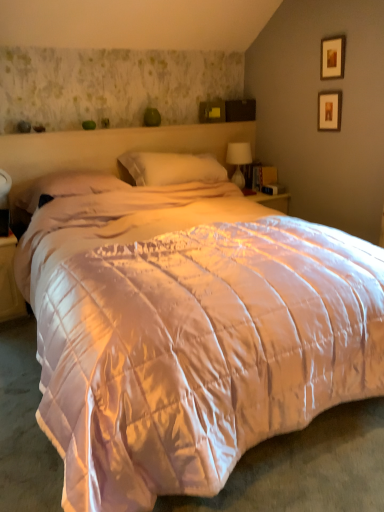
Question: Is pink satin pillow at center, the second pillow viewed from the right, to the left of wooden picture frame at upper right, placed as the second picture frame when sorted from bottom to top, from the viewer's perspective?

Choices:
 (A) yes
 (B) no

Answer: (A)

Question: From the image's perspective, would you say pink satin pillow at center, which is counted as the 1th pillow, starting from the left, is shown under wooden picture frame at upper right, placed as the second picture frame when sorted from bottom to top?

Choices:
 (A) yes
 (B) no

Answer: (A)

Question: Is pink satin pillow at center, the second pillow viewed from the right, turned away from wooden picture frame at upper right, placed as the second picture frame when sorted from bottom to top?

Choices:
 (A) yes
 (B) no

Answer: (B)

Question: Is wooden picture frame at upper right, which appears as the 1th picture frame when viewed from the top, completely or partially inside pink satin pillow at center, which is counted as the 1th pillow, starting from the left?

Choices:
 (A) no
 (B) yes

Answer: (A)

Question: From the image's perspective, is pink satin pillow at center, which is counted as the 1th pillow, starting from the left, on wooden picture frame at upper right, placed as the second picture frame when sorted from bottom to top?

Choices:
 (A) yes
 (B) no

Answer: (B)

Question: Is the position of pink satin pillow at center, which is counted as the 1th pillow, starting from the left, less distant than that of wooden picture frame at upper right, which appears as the 1th picture frame when viewed from the top?

Choices:
 (A) yes
 (B) no

Answer: (A)

Question: Does wooden picture frame at upper right, which appears as the 1th picture frame when viewed from the top, have a lesser width compared to pink satin pillow at center, the second pillow viewed from the right?

Choices:
 (A) no
 (B) yes

Answer: (B)

Question: Does wooden picture frame at upper right, which appears as the 1th picture frame when viewed from the top, have a smaller size compared to pink satin pillow at center, which is counted as the 1th pillow, starting from the left?

Choices:
 (A) no
 (B) yes

Answer: (B)

Question: Does wooden picture frame at upper right, which appears as the 1th picture frame when viewed from the top, turn towards pink satin pillow at center, which is counted as the 1th pillow, starting from the left?

Choices:
 (A) no
 (B) yes

Answer: (B)

Question: Is the surface of wooden picture frame at upper right, which appears as the 1th picture frame when viewed from the top, in direct contact with pink satin pillow at center, the second pillow viewed from the right?

Choices:
 (A) yes
 (B) no

Answer: (B)

Question: Is wooden picture frame at upper right, placed as the second picture frame when sorted from bottom to top, not close to pink satin pillow at center, the second pillow viewed from the right?

Choices:
 (A) no
 (B) yes

Answer: (B)

Question: From the image's perspective, is wooden picture frame at upper right, placed as the second picture frame when sorted from bottom to top, under pink satin pillow at center, which is counted as the 1th pillow, starting from the left?

Choices:
 (A) no
 (B) yes

Answer: (A)

Question: Is matte white nightstand at lower left next to white soft pillow at center, the 1th pillow when ordered from right to left?

Choices:
 (A) yes
 (B) no

Answer: (B)